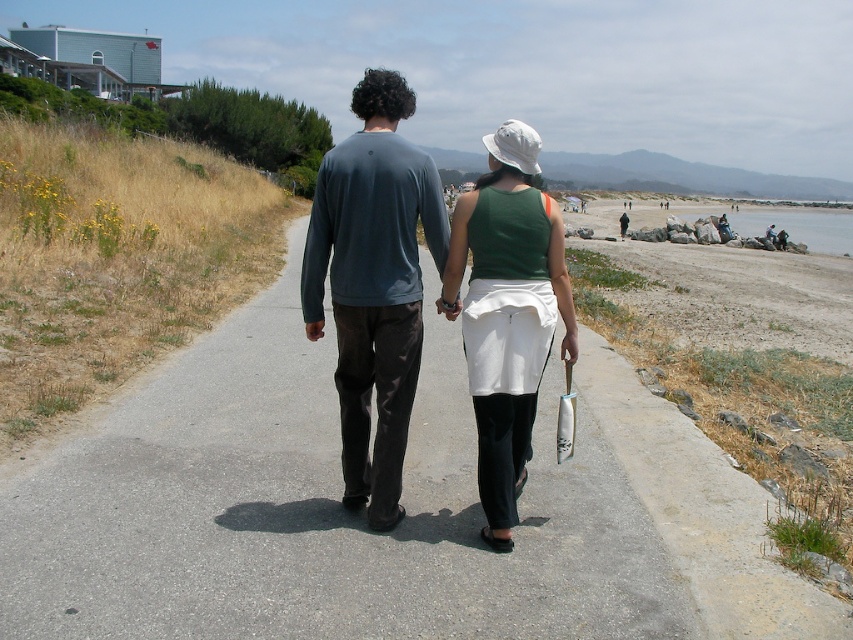
From the picture: You are standing at the coordinates given in the image. There is an asphalt road at center. Can you walk on it?

The asphalt road at center is located at point (316, 509), so yes, you can walk on it since it is a paved path.

In the scene shown: You are a photographer standing at the center of the coastal path. You want to take a photo of the dark gray sweater at center. Where should you aim your camera to capture it?

You should aim your camera at point (373, 284) to capture the dark gray sweater at center.